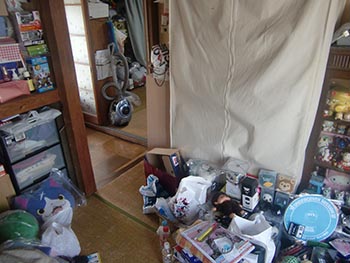
Where is `bin`? bin is located at coordinates (36, 145), (44, 170).